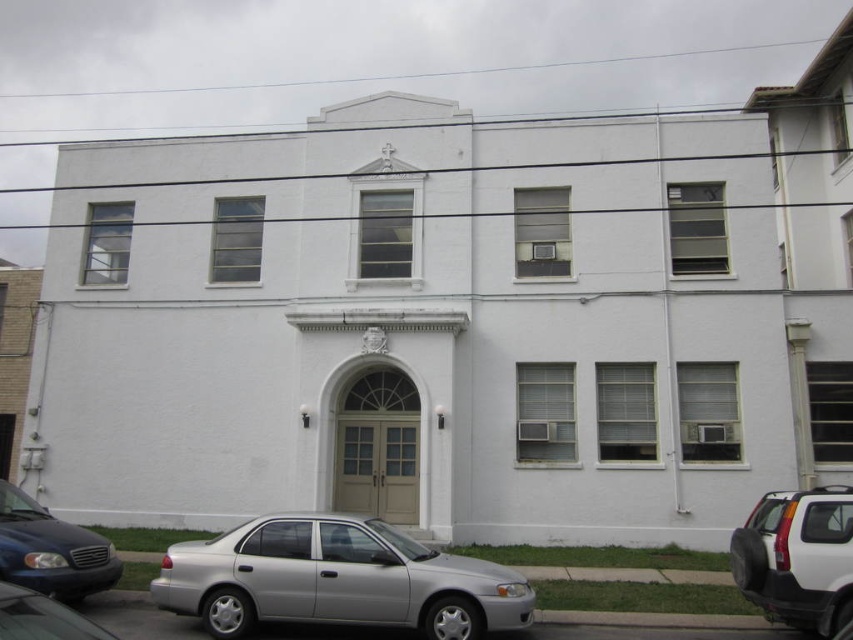
You are driving a car that is 15 feet long and want to park between the white matte suv at right and the matte black sedan at lower left. Is there enough space between them to park your car?

The white matte suv at right is 23.16 feet away from the matte black sedan at lower left. Since your car is 15 feet long, there is sufficient space between them to park your car.

You are a delivery driver who needs to park your vehicle in the parking lot behind the two story white building. There is a white matte suv at right and a matte black sedan at lower left already parked. Which vehicle should you avoid parking to the left of to ensure you have enough space?

You should avoid parking to the left of the white matte suv at right because it is positioned to the right of the matte black sedan at lower left, meaning there might be limited space between them.

You are a delivery person trying to park your shiny black sedan at lower left next to the matte black sedan at lower left. Since both cars are at the lower left of the scene, will your car be visible from the entrance of the building?

The matte black sedan at lower left is taller than the shiny black sedan at lower left. Since the taller matte black sedan is in front, it may block the view of the shiny black sedan at lower left from the entrance.